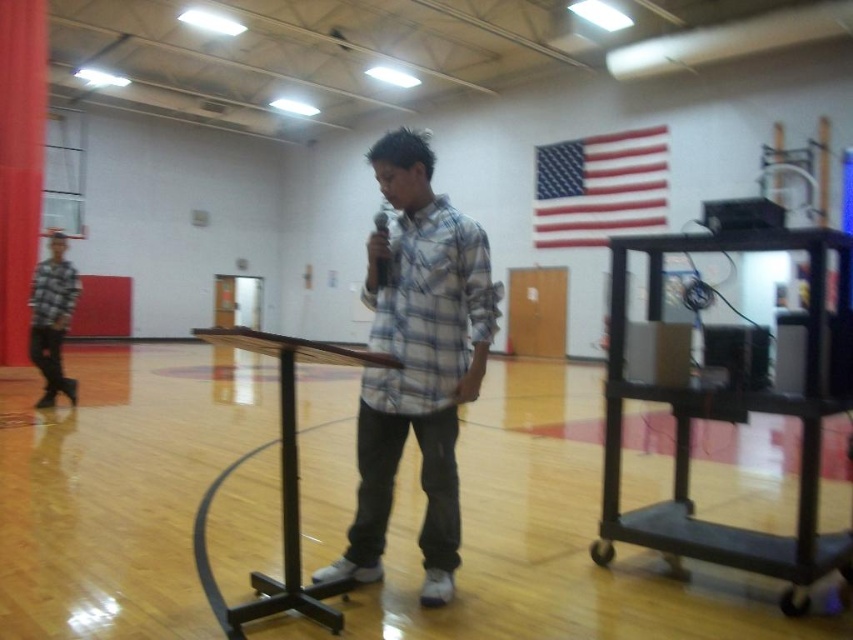
Question: Does black metal cart at center have a smaller size compared to red fabric flag at upper right?

Choices:
 (A) yes
 (B) no

Answer: (A)

Question: Is plaid shirt at center behind brown wood podium at center?

Choices:
 (A) no
 (B) yes

Answer: (B)

Question: Estimate the real-world distances between objects in this image. Which object is closer to the black metal cart at center?

Choices:
 (A) brown wood podium at center
 (B) plaid shirt at center
 (C) red velvet curtain at left
 (D) plaid shirt at left

Answer: (B)

Question: Does plaid shirt at center have a lesser width compared to black metal cart at center?

Choices:
 (A) no
 (B) yes

Answer: (B)

Question: Which of the following is the closest to the observer?

Choices:
 (A) plaid shirt at center
 (B) black metal cart at center
 (C) brown wood podium at center

Answer: (C)

Question: Which point is farther to the camera?

Choices:
 (A) red fabric flag at upper right
 (B) red velvet curtain at left

Answer: (A)